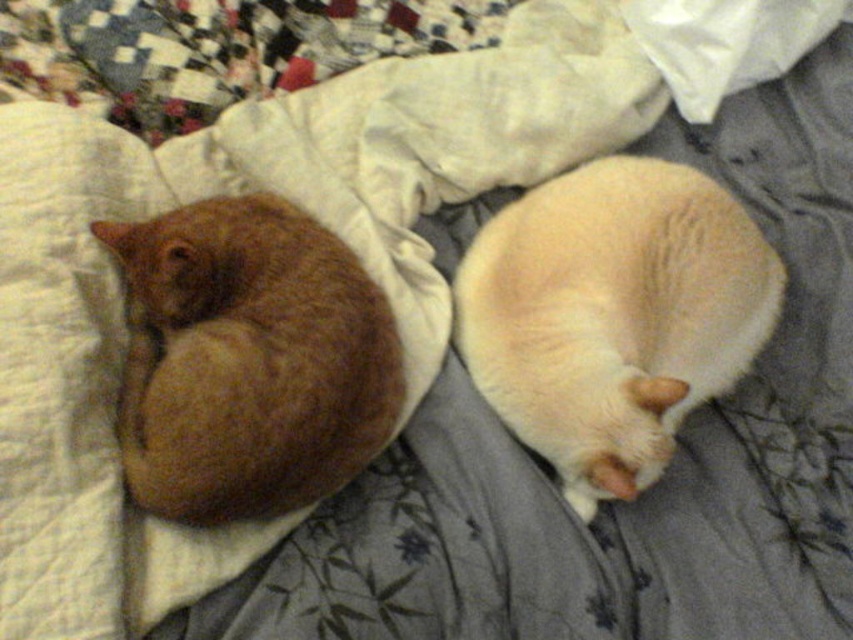
Question: Which point is farther to the camera?

Choices:
 (A) (209, 524)
 (B) (643, 456)

Answer: (B)

Question: Which object appears farthest from the camera in this image?

Choices:
 (A) orange fur cat at left
 (B) soft cream fur cat at right

Answer: (B)

Question: Which point appears farthest from the camera in this image?

Choices:
 (A) (341, 340)
 (B) (747, 346)

Answer: (B)

Question: Observing the image, what is the correct spatial positioning of soft cream fur cat at right in reference to orange fur cat at left?

Choices:
 (A) right
 (B) left

Answer: (A)

Question: From the image, what is the correct spatial relationship of soft cream fur cat at right in relation to orange fur cat at left?

Choices:
 (A) above
 (B) below

Answer: (A)

Question: In this image, where is soft cream fur cat at right located relative to orange fur cat at left?

Choices:
 (A) below
 (B) above

Answer: (B)